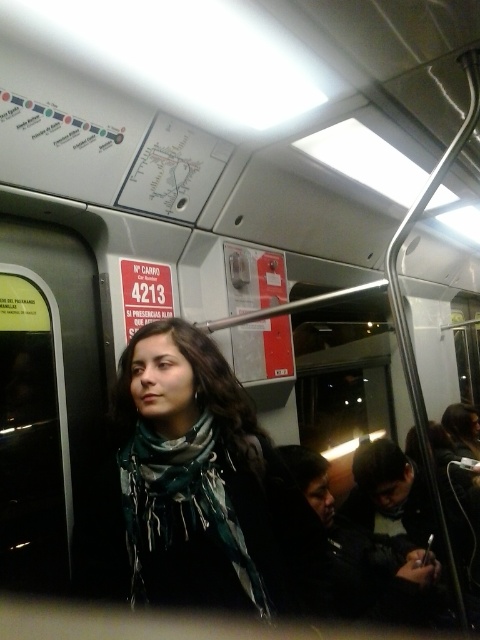
You are standing inside the subway car and want to determine the spatial relationship between two points marked in the image. Which point is closer to you, point [253,561] or point [175,531]?

Point [253,561] is closer to the viewer than point [175,531].

From the picture: You are standing in the subway car and see the point marked at coordinates (195,486). What object is located at that point?

The point at coordinates (195,486) corresponds to the green scarf at center.